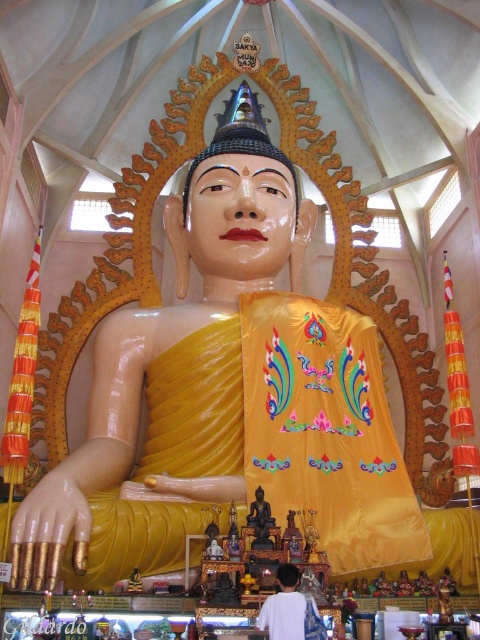
Question: Is matte gold statue at center bigger than white fabric at lower center?

Choices:
 (A) no
 (B) yes

Answer: (B)

Question: Observing the image, what is the correct spatial positioning of white fabric at lower center in reference to black glossy statue at center?

Choices:
 (A) below
 (B) above

Answer: (A)

Question: Which point is farther to the camera?

Choices:
 (A) matte gold statue at center
 (B) white fabric at lower center
 (C) black glossy statue at center

Answer: (C)

Question: Among these points, which one is farthest from the camera?

Choices:
 (A) (276, 176)
 (B) (255, 538)
 (C) (303, 632)

Answer: (A)

Question: Is matte gold statue at center to the left of black glossy statue at center from the viewer's perspective?

Choices:
 (A) no
 (B) yes

Answer: (A)

Question: Based on their relative distances, which object is farther from the matte gold statue at center?

Choices:
 (A) white fabric at lower center
 (B) black glossy statue at center

Answer: (A)